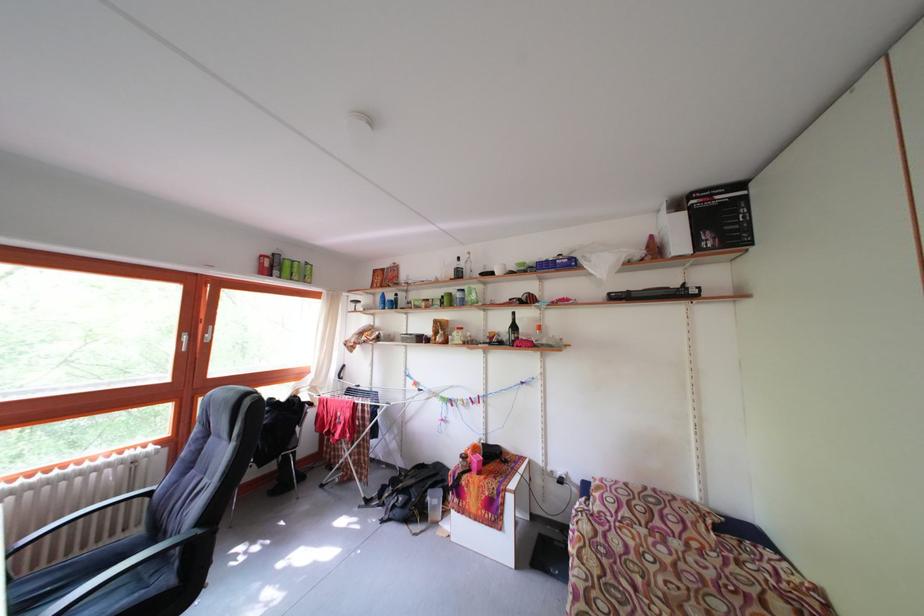
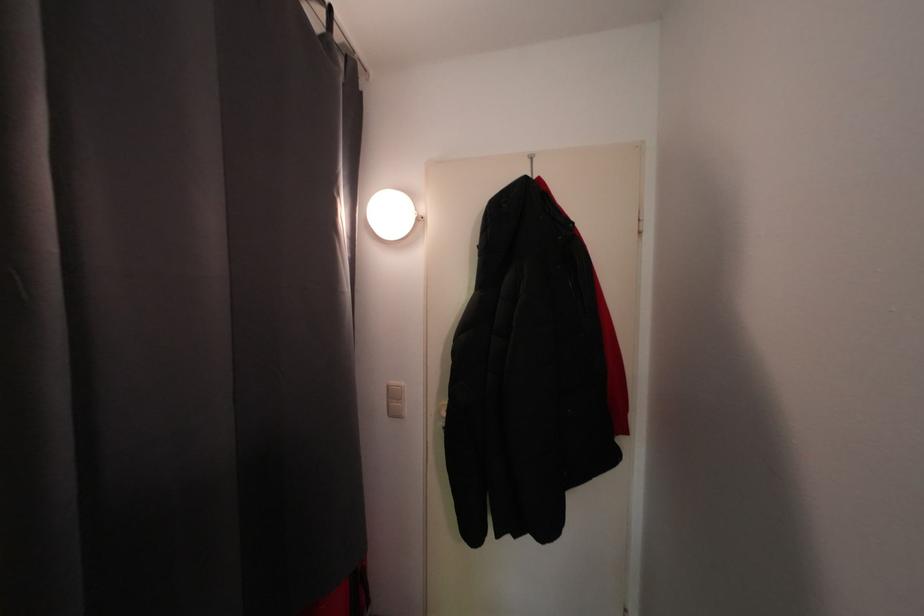
Question: Based on the continuous images, in which direction is the camera rotating? Reply with the corresponding letter.

Choices:
 (A) Left
 (B) Right
 (C) Up
 (D) Down

Answer: (B)